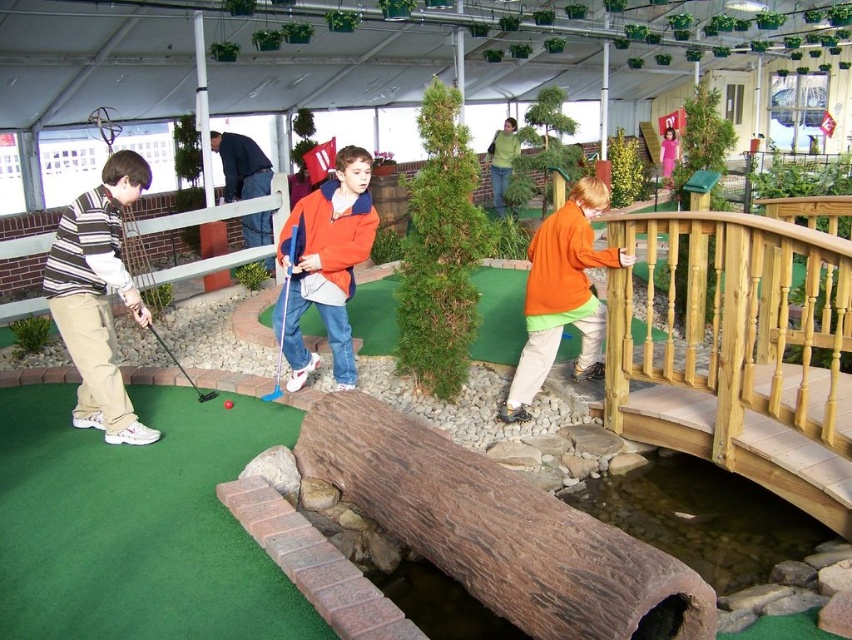
Question: Among these objects, which one is farthest from the camera?

Choices:
 (A) metallic silver golf club at lower left
 (B) orange fleece jacket at upper right
 (C) brown rough wood log at center
 (D) green artificial turf at lower left

Answer: (B)

Question: Among these points, which one is nearest to the camera?

Choices:
 (A) (237, 161)
 (B) (183, 388)
 (C) (227, 403)
 (D) (579, 312)

Answer: (D)

Question: Does metallic blue golf club at center appear under metallic silver golf club at lower left?

Choices:
 (A) no
 (B) yes

Answer: (A)

Question: Among these points, which one is farthest from the camera?

Choices:
 (A) (239, 157)
 (B) (148, 328)

Answer: (A)

Question: Can you confirm if orange fleece jacket at upper right is positioned above dark blue sweater at upper left?

Choices:
 (A) yes
 (B) no

Answer: (B)

Question: Does brown rough wood log at center appear on the left side of striped sweater at left?

Choices:
 (A) yes
 (B) no

Answer: (B)